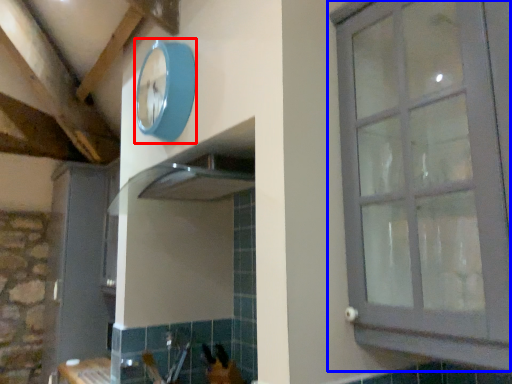
Question: Which object is closer to the camera taking this photo, clock (highlighted by a red box) or window (highlighted by a blue box)?

Choices:
 (A) clock
 (B) window

Answer: (B)